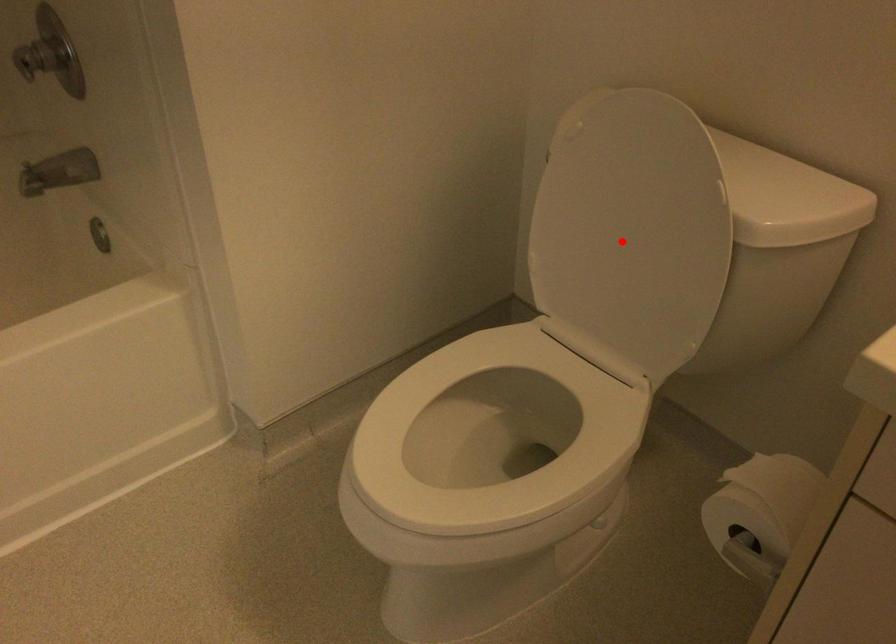
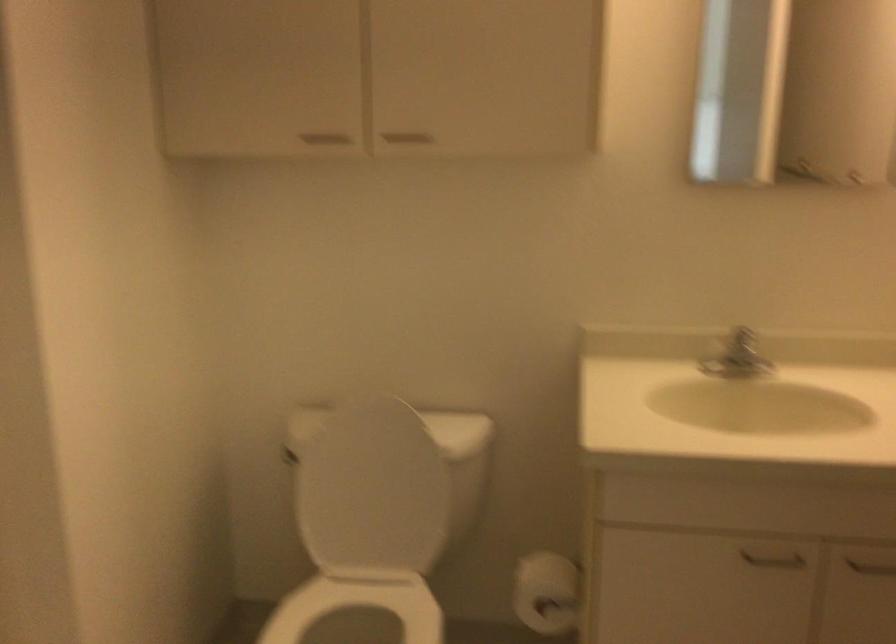
Question: I am providing you with two images of the same scene from different viewpoints. A red point is shown in image1. For the corresponding object point in image2, is it positioned nearer or farther from the camera?

Choices:
 (A) Nearer
 (B) Farther

Answer: (B)